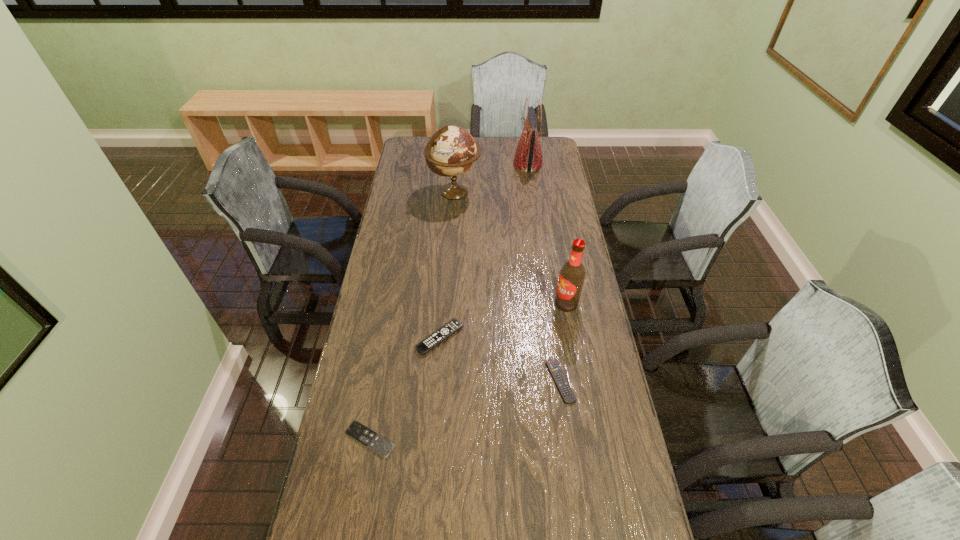
The height and width of the screenshot is (540, 960). Identify the location of empty space that is in between the globe and the beer bottle. (511, 248).

Identify the location of empty location between the shortest remote control and the farthest object. This screenshot has height=540, width=960. (449, 302).

The image size is (960, 540). I want to click on unoccupied position between the handbag and the second farthest object, so click(492, 178).

The height and width of the screenshot is (540, 960). Identify the location of vacant area between the second nearest remote control and the fifth nearest object. (508, 287).

The image size is (960, 540). I want to click on empty space that is in between the second farthest remote control and the leftmost remote control, so click(x=465, y=410).

Locate which object is the fourth closest to the shortest object. Please provide its 2D coordinates. Your answer should be formatted as a tuple, i.e. [(x, y)], where the tuple contains the x and y coordinates of a point satisfying the conditions above.

[(452, 150)]

Identify which object is the fifth nearest to the second farthest remote control. Please provide its 2D coordinates. Your answer should be formatted as a tuple, i.e. [(x, y)], where the tuple contains the x and y coordinates of a point satisfying the conditions above.

[(528, 157)]

Locate which remote control ranks second in proximity to the second tallest remote control. Please provide its 2D coordinates. Your answer should be formatted as a tuple, i.e. [(x, y)], where the tuple contains the x and y coordinates of a point satisfying the conditions above.

[(365, 436)]

At what (x,y) coordinates should I click in order to perform the action: click on remote control that is the second closest to the fourth farthest object. Please return your answer as a coordinate pair (x, y). Looking at the image, I should click on (554, 368).

I want to click on free location that satisfies the following two spatial constraints: 1. on the front of the fifth nearest object showing Asia; 2. on the right side of the second farthest remote control, so click(442, 381).